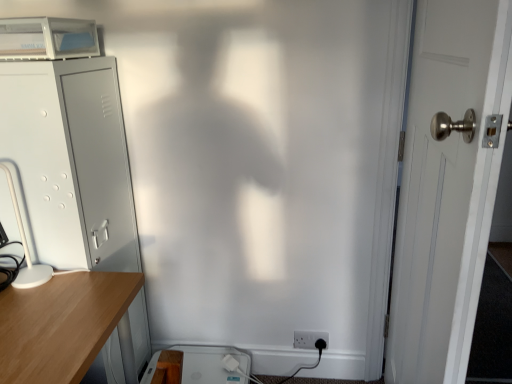
Question: From a real-world perspective, is gray metallic file cabinet at left positioned above or below white plastic desktop at lower center?

Choices:
 (A) above
 (B) below

Answer: (A)

Question: Is point (80, 74) closer or farther from the camera than point (240, 377)?

Choices:
 (A) farther
 (B) closer

Answer: (B)

Question: Which object is positioned farthest from the white plastic electric outlet at lower right?

Choices:
 (A) white wooden door at right
 (B) gray metallic file cabinet at left
 (C) white plastic desktop at lower center
 (D) white plastic table lamp at left

Answer: (D)

Question: Estimate the real-world distances between objects in this image. Which object is closer to the white plastic desktop at lower center?

Choices:
 (A) white wooden door at right
 (B) white plastic electric outlet at lower right
 (C) gray metallic file cabinet at left
 (D) white plastic table lamp at left

Answer: (B)